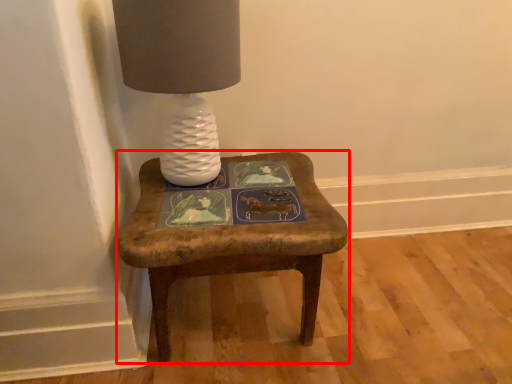
Question: From the image's perspective, considering the relative positions of stool (annotated by the red box) and table lamp in the image provided, where is stool (annotated by the red box) located with respect to the staircase?

Choices:
 (A) above
 (B) below

Answer: (B)